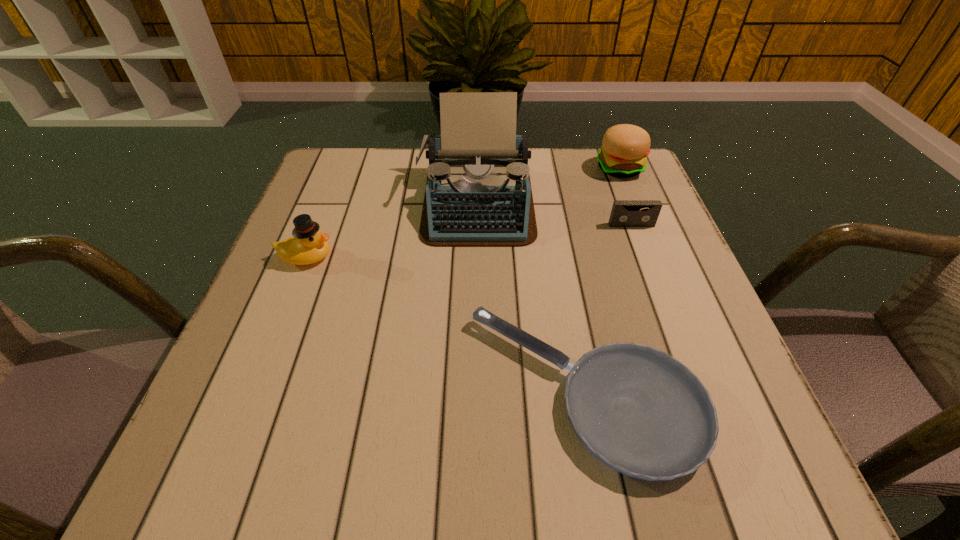
Image resolution: width=960 pixels, height=540 pixels. In order to click on the tallest object in this screenshot , I will do `click(478, 193)`.

Find the location of a particular element. This screenshot has width=960, height=540. hamburger is located at coordinates (625, 147).

The height and width of the screenshot is (540, 960). I want to click on the leftmost object, so click(308, 245).

Identify the location of videotape. (625, 213).

Image resolution: width=960 pixels, height=540 pixels. I want to click on the nearest object, so click(643, 413).

Identify the location of frying pan. The width and height of the screenshot is (960, 540). (643, 413).

You are a GUI agent. You are given a task and a screenshot of the screen. Output one action in this format:
    pyautogui.click(x=<x>, y=<y>)
    Task: Click on the vacant space situated 0.350m on the typing side of the tallest object
    
    Given the screenshot: What is the action you would take?
    pyautogui.click(x=475, y=397)

Locate an element on the screen. free space located 0.250m on the left of the hamburger is located at coordinates (499, 168).

At what (x,y) coordinates should I click in order to perform the action: click on vacant space located on the front-facing side of the leftmost object. Please return your answer as a coordinate pair (x, y). Image resolution: width=960 pixels, height=540 pixels. Looking at the image, I should click on (379, 257).

Where is `vacant region located 0.360m on the front-facing side of the fourth tallest object`? vacant region located 0.360m on the front-facing side of the fourth tallest object is located at coordinates (684, 367).